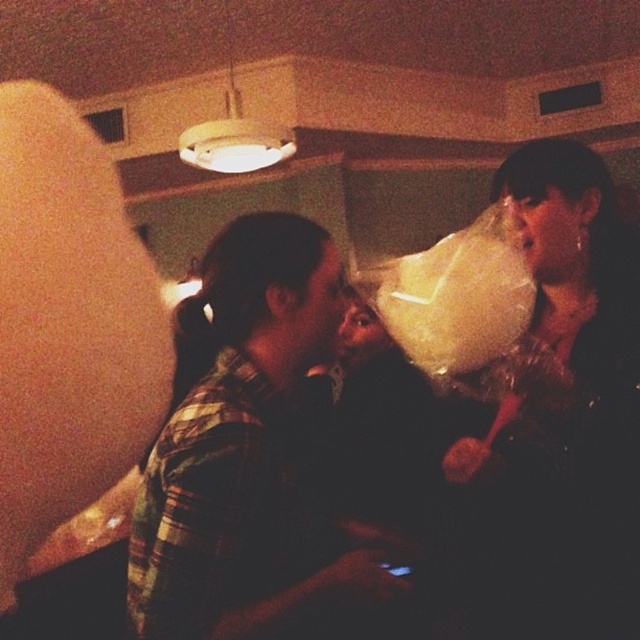
You are standing in the scene and want to locate the green plaid shirt at center. What are its coordinates?

The green plaid shirt at center is located at coordinates point (243, 445).